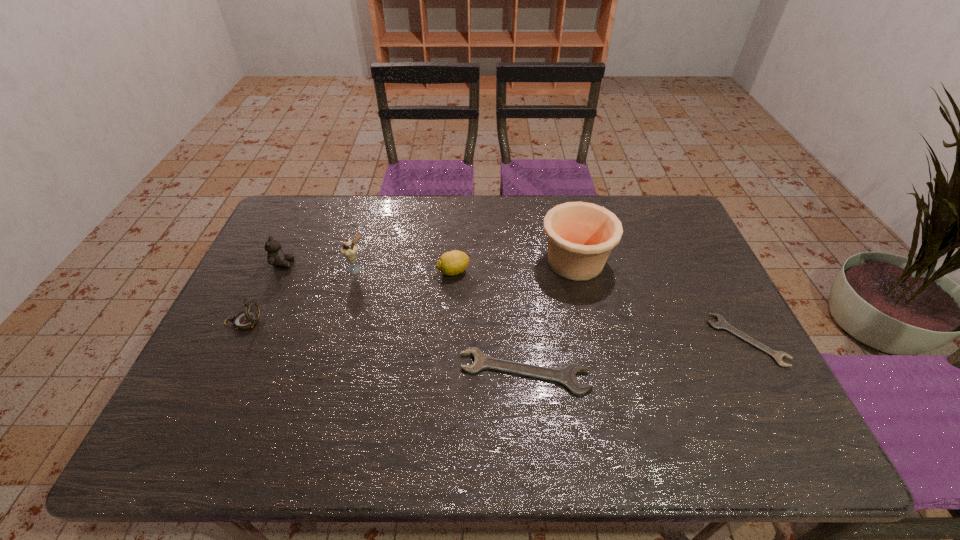
Please point a vacant point for placing a wrench on the left. Please provide its 2D coordinates. Your answer should be formatted as a tuple, i.e. [(x, y)], where the tuple contains the x and y coordinates of a point satisfying the conditions above.

[(273, 408)]